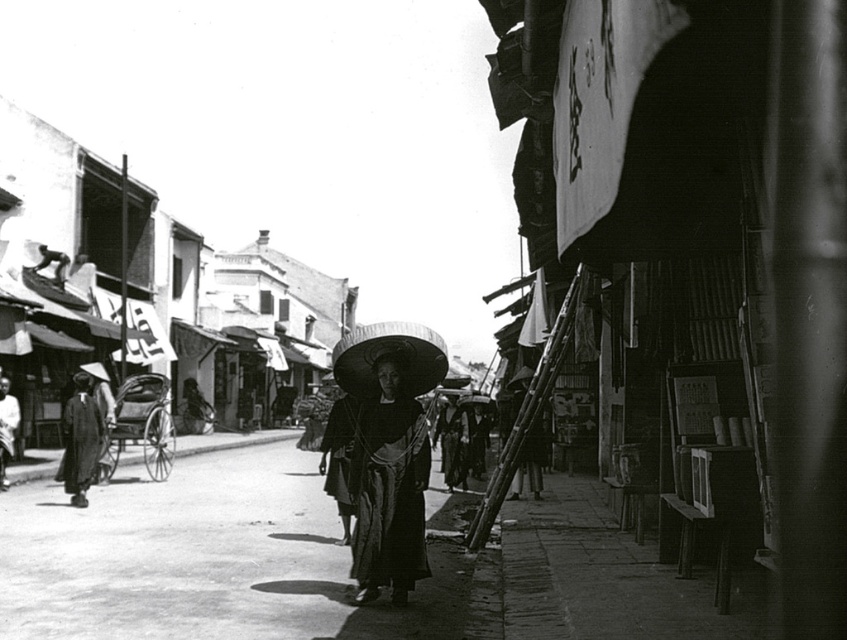
Identify the location of smooth concrete pavement at center. The image size is (847, 640). (214, 560).

The image size is (847, 640). In order to click on smooth concrete pavement at center in this screenshot , I will do `click(214, 560)`.

Find the location of `matte black dress at center`. matte black dress at center is located at coordinates (388, 483).

Based on the photo, how much distance is there between smooth concrete pavement at center and matte black dress at center?

smooth concrete pavement at center and matte black dress at center are 2.27 meters apart.

Who is taller, smooth concrete pavement at center or matte black dress at center?

With more height is matte black dress at center.

Measure the distance between point (61, 563) and camera.

They are 9.10 meters apart.

Locate an element on the screen. This screenshot has width=847, height=640. smooth concrete pavement at center is located at coordinates (214, 560).